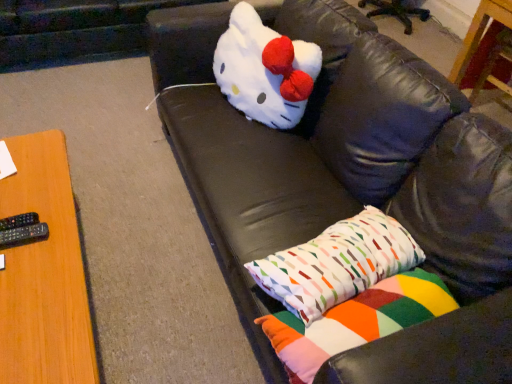
I want to click on unoccupied region to the right of black plastic remote at left, placed as the 1th remote when sorted from bottom to top, so click(x=51, y=252).